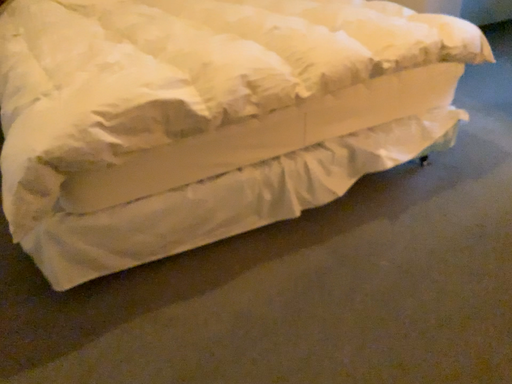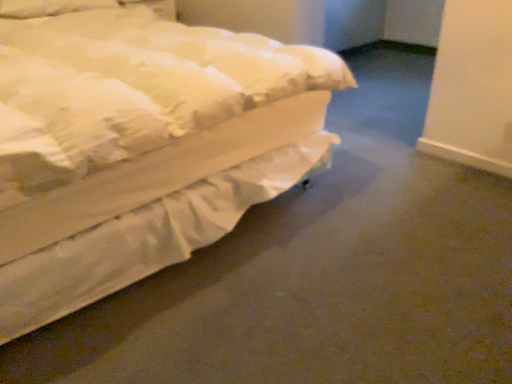
Question: How did the camera likely rotate when shooting the video?

Choices:
 (A) rotated right
 (B) rotated left

Answer: (A)